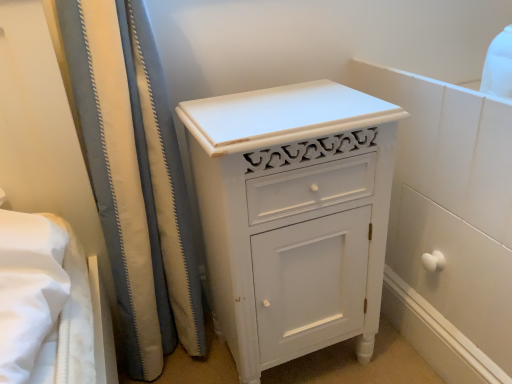
Question: Is white fabric shower curtain at left thinner than white painted wood cabinet at center?

Choices:
 (A) no
 (B) yes

Answer: (B)

Question: Can you confirm if white fabric shower curtain at left is bigger than white painted wood cabinet at center?

Choices:
 (A) no
 (B) yes

Answer: (B)

Question: Considering the relative sizes of white fabric shower curtain at left and white painted wood cabinet at center in the image provided, is white fabric shower curtain at left smaller than white painted wood cabinet at center?

Choices:
 (A) no
 (B) yes

Answer: (A)

Question: Can you confirm if white fabric shower curtain at left is positioned to the right of white painted wood cabinet at center?

Choices:
 (A) no
 (B) yes

Answer: (A)

Question: Is white fabric shower curtain at left completely or partially outside of white painted wood cabinet at center?

Choices:
 (A) no
 (B) yes

Answer: (B)

Question: From a real-world perspective, is white fabric shower curtain at left on top of white painted wood cabinet at center?

Choices:
 (A) no
 (B) yes

Answer: (B)

Question: Is white painted wood cabinet at center directly adjacent to white fabric shower curtain at left?

Choices:
 (A) yes
 (B) no

Answer: (B)

Question: Can you confirm if white painted wood cabinet at center is smaller than white fabric shower curtain at left?

Choices:
 (A) no
 (B) yes

Answer: (B)

Question: Are white painted wood cabinet at center and white fabric shower curtain at left far apart?

Choices:
 (A) yes
 (B) no

Answer: (B)

Question: Is white painted wood cabinet at center at the right side of white fabric shower curtain at left?

Choices:
 (A) no
 (B) yes

Answer: (B)

Question: Considering the relative sizes of white painted wood cabinet at center and white fabric shower curtain at left in the image provided, is white painted wood cabinet at center shorter than white fabric shower curtain at left?

Choices:
 (A) no
 (B) yes

Answer: (B)

Question: Does white painted wood cabinet at center have a lesser width compared to white fabric shower curtain at left?

Choices:
 (A) yes
 (B) no

Answer: (B)

Question: Is white painted wood cabinet at center to the left or to the right of white fabric shower curtain at left in the image?

Choices:
 (A) right
 (B) left

Answer: (A)